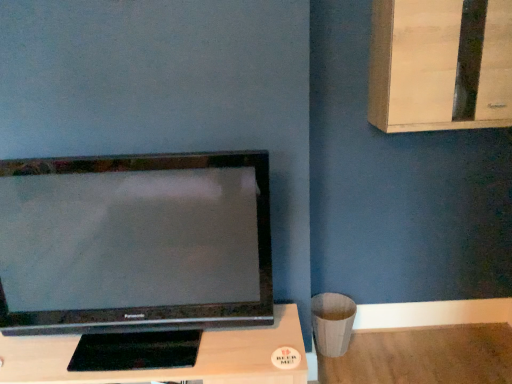
The width and height of the screenshot is (512, 384). What are the coordinates of `vacant location below satin black television at left (from a real-world perspective)` in the screenshot? It's located at (138, 354).